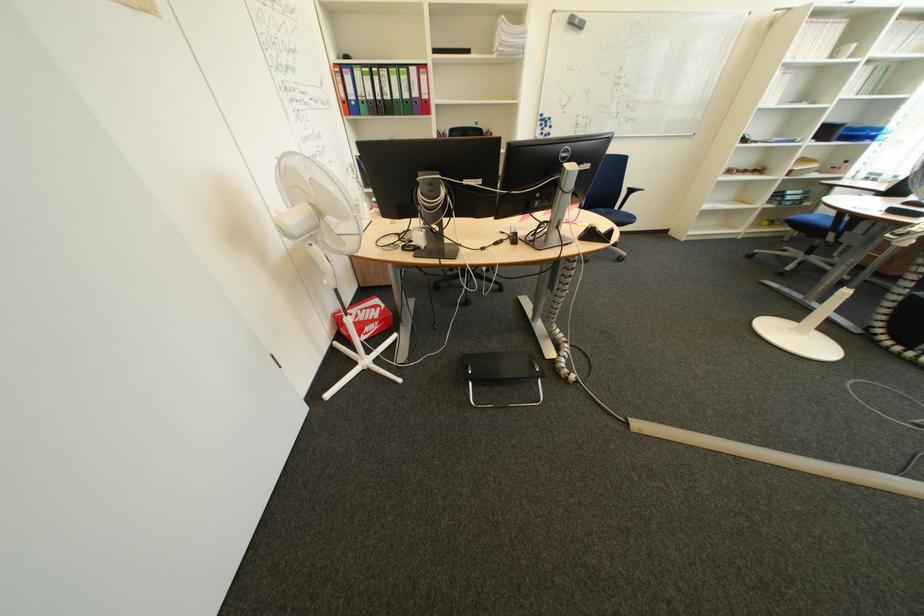
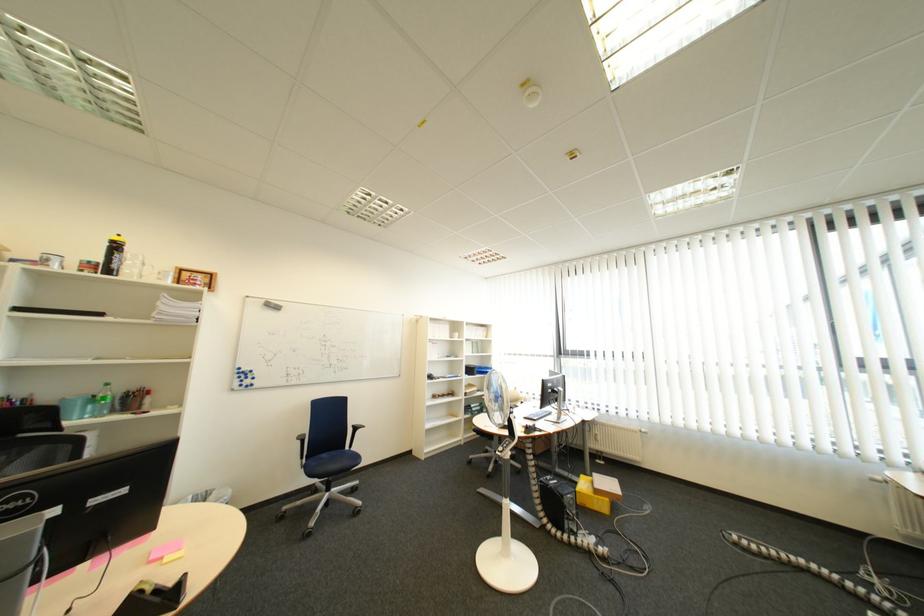
First-person continuous shooting, in which direction is the camera rotating?

The camera's rotation is toward right-up.